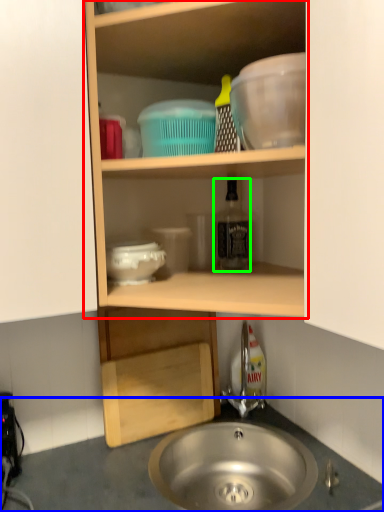
Question: Which object is positioned farthest from shelf (highlighted by a red box)? Select from countertop (highlighted by a blue box) and bottle (highlighted by a green box).

Choices:
 (A) countertop
 (B) bottle

Answer: (A)